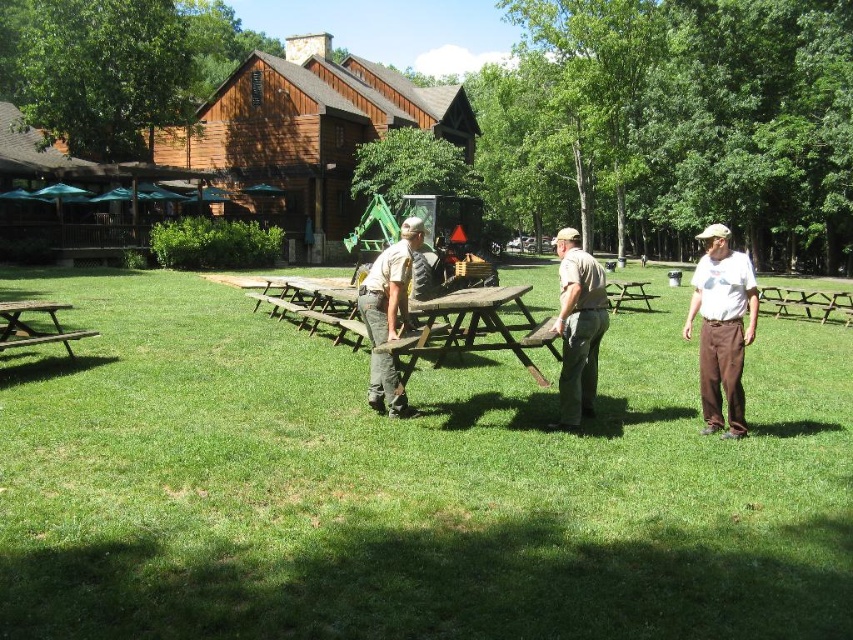
Question: Which point is closer to the camera?

Choices:
 (A) (701, 275)
 (B) (726, 385)
 (C) (634, 332)
 (D) (514, 296)

Answer: (B)

Question: Among these points, which one is farthest from the camera?

Choices:
 (A) (387, 320)
 (B) (461, 387)
 (C) (21, 324)
 (D) (564, 305)

Answer: (C)

Question: Observing the image, what is the correct spatial positioning of white cotton shirt at center in reference to khaki uniform at center?

Choices:
 (A) left
 (B) right

Answer: (B)

Question: Considering the relative positions of white cotton shirt at center and tan uniform at center in the image provided, where is white cotton shirt at center located with respect to tan uniform at center?

Choices:
 (A) below
 (B) above

Answer: (A)

Question: Can you confirm if khaki uniform at center is positioned above wooden picnic table at left?

Choices:
 (A) no
 (B) yes

Answer: (B)

Question: Based on their relative distances, which object is nearer to the tan uniform at center?

Choices:
 (A) white cotton shirt at center
 (B) wooden picnic table at left

Answer: (A)